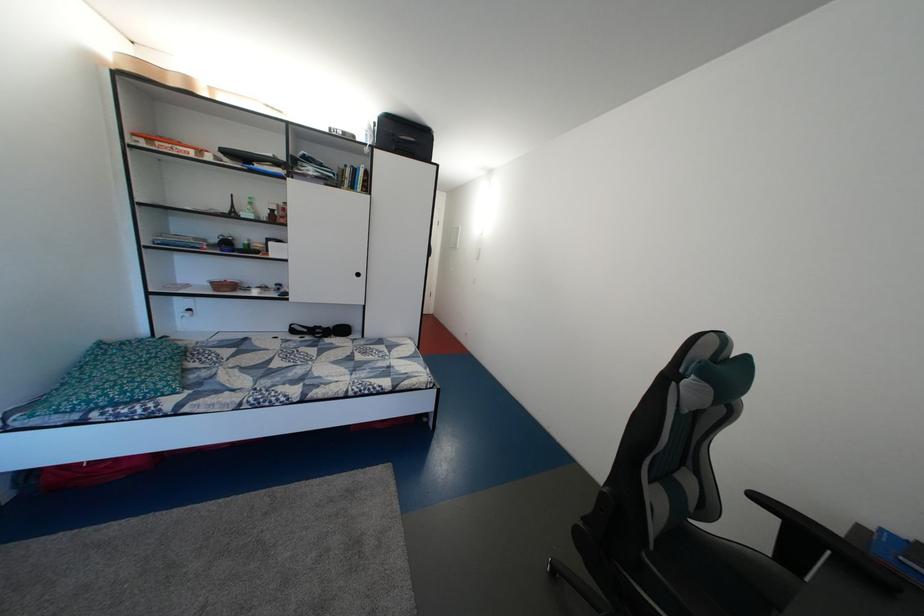
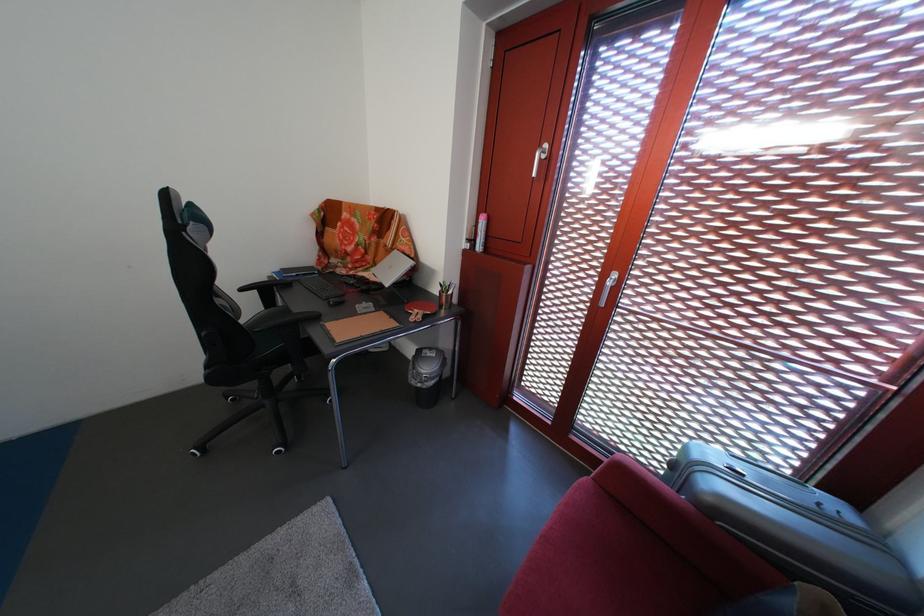
Find the pixel in the second image that matches point 803,561 in the first image.

(280, 308)